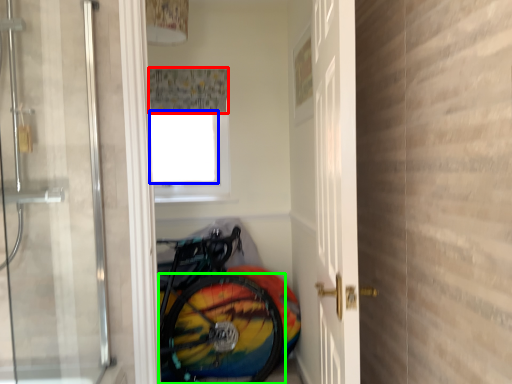
Question: Considering the real-world distances, which object is farthest from shower curtain (highlighted by a red box)? window screen (highlighted by a blue box) or bicycle wheel (highlighted by a green box)?

Choices:
 (A) window screen
 (B) bicycle wheel

Answer: (B)